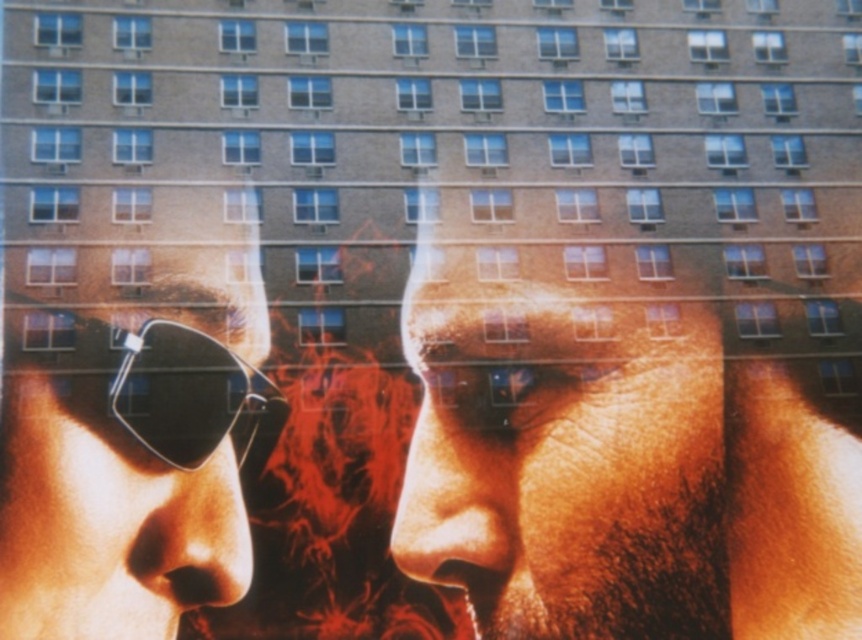
Question: Estimate the real-world distances between objects in this image. Which object is farther from the matte black sunglasses at left?

Choices:
 (A) black matte goggles at left
 (B) smooth skin face at center

Answer: (B)

Question: Which is nearer to the black matte goggles at left?

Choices:
 (A) matte black sunglasses at left
 (B) smooth skin face at center

Answer: (A)

Question: Which object appears farthest from the camera in this image?

Choices:
 (A) black matte goggles at left
 (B) matte black sunglasses at left

Answer: (A)

Question: Is smooth skin face at center below black matte goggles at left?

Choices:
 (A) yes
 (B) no

Answer: (A)

Question: Does smooth skin face at center have a smaller size compared to matte black sunglasses at left?

Choices:
 (A) yes
 (B) no

Answer: (B)

Question: Can you confirm if smooth skin face at center is positioned to the left of black matte goggles at left?

Choices:
 (A) yes
 (B) no

Answer: (B)